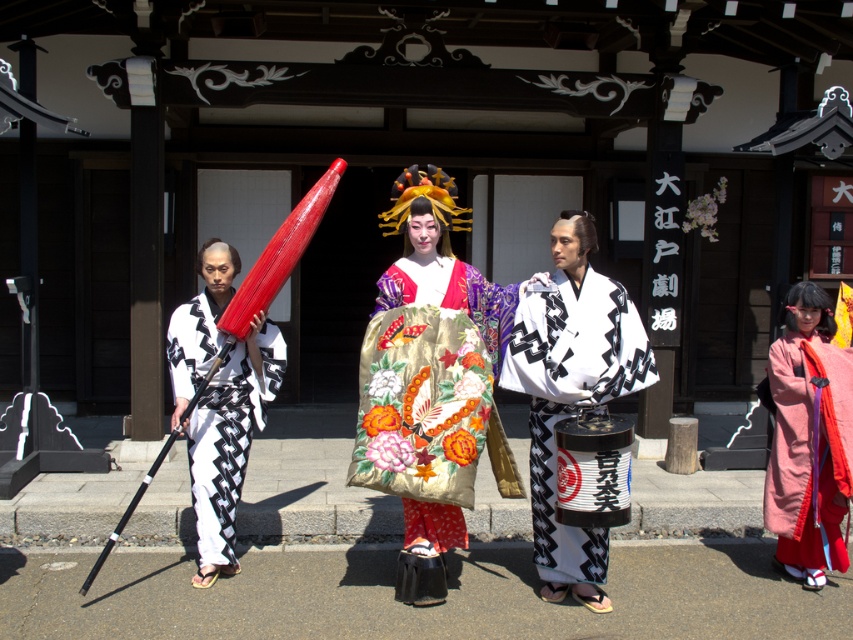
Can you confirm if silky pink kimono at center is wider than matte black kimono at left?

In fact, silky pink kimono at center might be narrower than matte black kimono at left.

This screenshot has height=640, width=853. What do you see at coordinates (808, 438) in the screenshot?
I see `silky pink kimono at center` at bounding box center [808, 438].

The width and height of the screenshot is (853, 640). In order to click on silky pink kimono at center in this screenshot , I will do `click(808, 438)`.

Which is above, silky silk kimono at center or matte black kimono at left?

silky silk kimono at center

Can you confirm if silky silk kimono at center is positioned above matte black kimono at left?

Correct, silky silk kimono at center is located above matte black kimono at left.

What do you see at coordinates (431, 381) in the screenshot? The height and width of the screenshot is (640, 853). I see `silky silk kimono at center` at bounding box center [431, 381].

The width and height of the screenshot is (853, 640). I want to click on silky silk kimono at center, so point(431,381).

Is silky silk kimono at center smaller than silky pink kimono at center?

Actually, silky silk kimono at center might be larger than silky pink kimono at center.

Is silky silk kimono at center bigger than silky pink kimono at center?

Indeed, silky silk kimono at center has a larger size compared to silky pink kimono at center.

Is point (492, 436) less distant than point (796, 547)?

That is True.

Where is `silky silk kimono at center`? silky silk kimono at center is located at coordinates (431, 381).